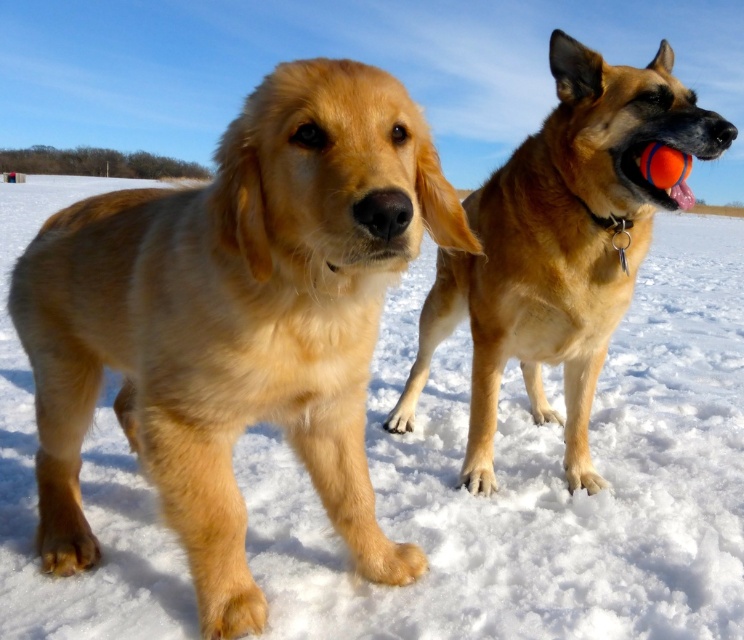
Does golden fur dog at center appear on the right side of golden fur dog at right?

No, golden fur dog at center is not to the right of golden fur dog at right.

Which is above, golden fur dog at center or golden fur dog at right?

golden fur dog at right is above.

What do you see at coordinates (237, 321) in the screenshot? This screenshot has height=640, width=744. I see `golden fur dog at center` at bounding box center [237, 321].

Where is `golden fur dog at center`? golden fur dog at center is located at coordinates (237, 321).